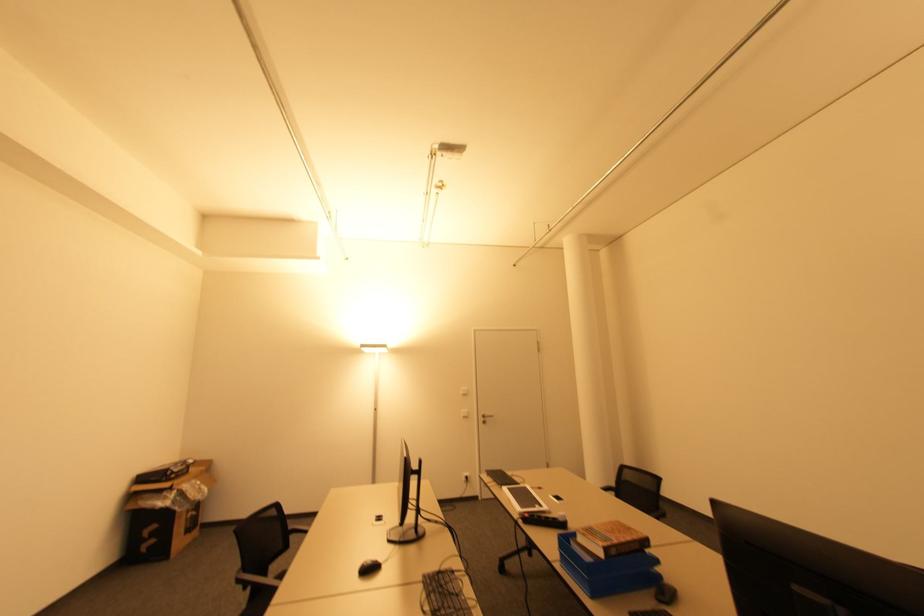
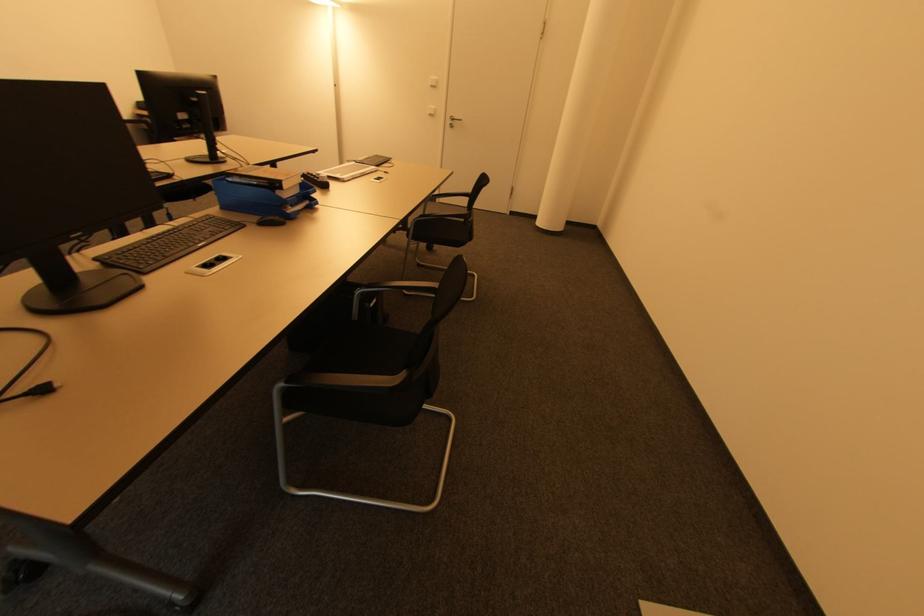
Where in the second image is the point corresponding to point (485, 422) from the first image?

(454, 127)